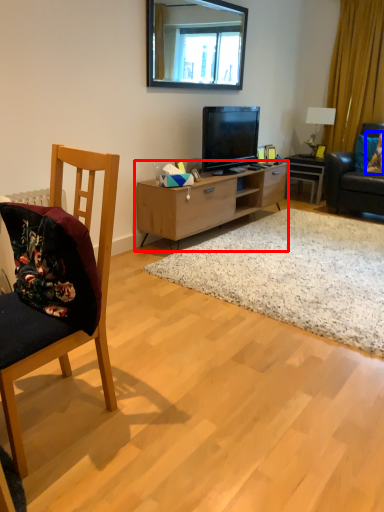
Question: Which of the following is the farthest to the observer, cabinetry (highlighted by a red box) or pillow (highlighted by a blue box)?

Choices:
 (A) cabinetry
 (B) pillow

Answer: (B)